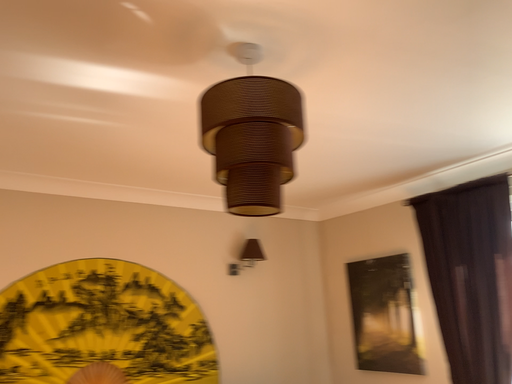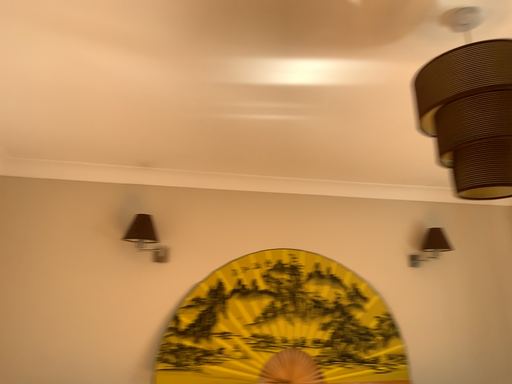
Question: Which way did the camera rotate in the video?

Choices:
 (A) rotated left
 (B) rotated right

Answer: (A)